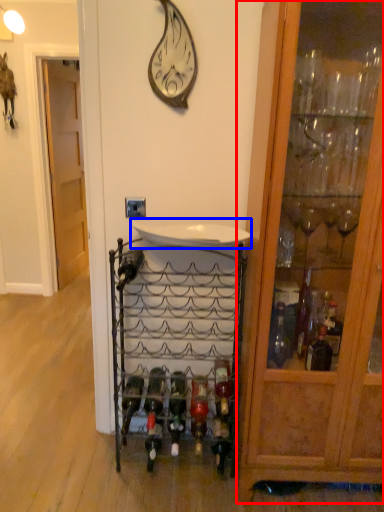
Question: Which object appears farthest to the camera in this image, cabinetry (highlighted by a red box) or sink (highlighted by a blue box)?

Choices:
 (A) cabinetry
 (B) sink

Answer: (B)